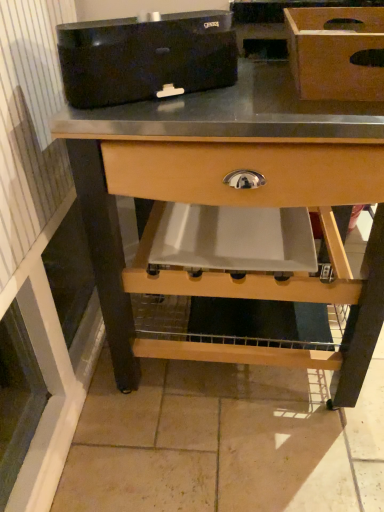
Question: Visually, is wooden box at upper right positioned to the left or to the right of natural wood table at center?

Choices:
 (A) left
 (B) right

Answer: (B)

Question: Is wooden box at upper right taller or shorter than natural wood table at center?

Choices:
 (A) tall
 (B) short

Answer: (B)

Question: Which is farther from the black plastic toaster at upper center?

Choices:
 (A) wooden box at upper right
 (B) natural wood table at center

Answer: (A)

Question: Estimate the real-world distances between objects in this image. Which object is farther from the wooden box at upper right?

Choices:
 (A) black plastic toaster at upper center
 (B) natural wood table at center

Answer: (B)